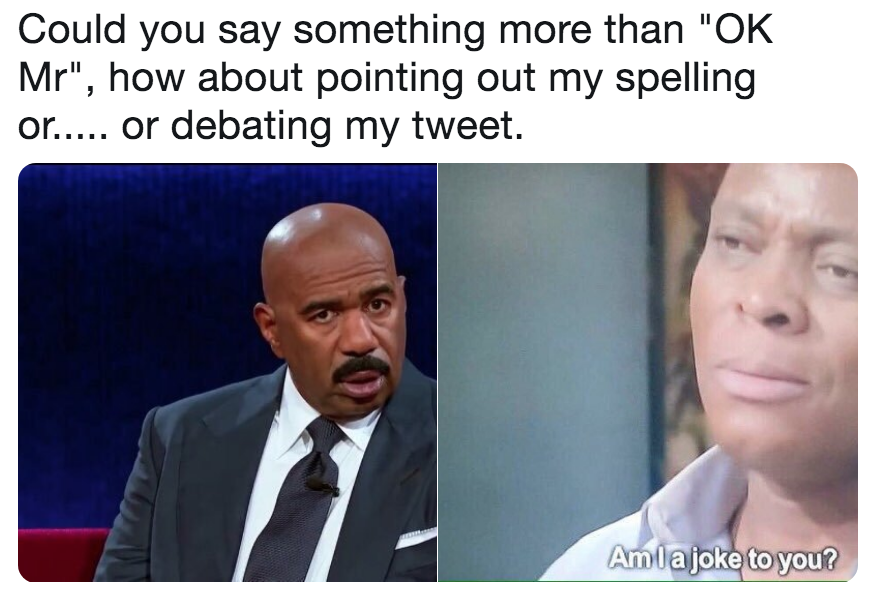
Identify the location of red couch. (76, 539).